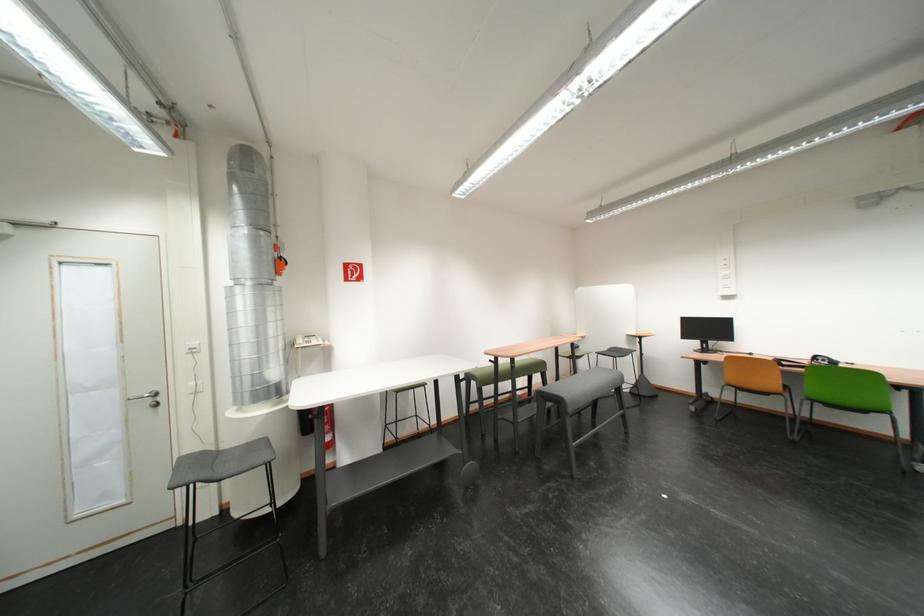
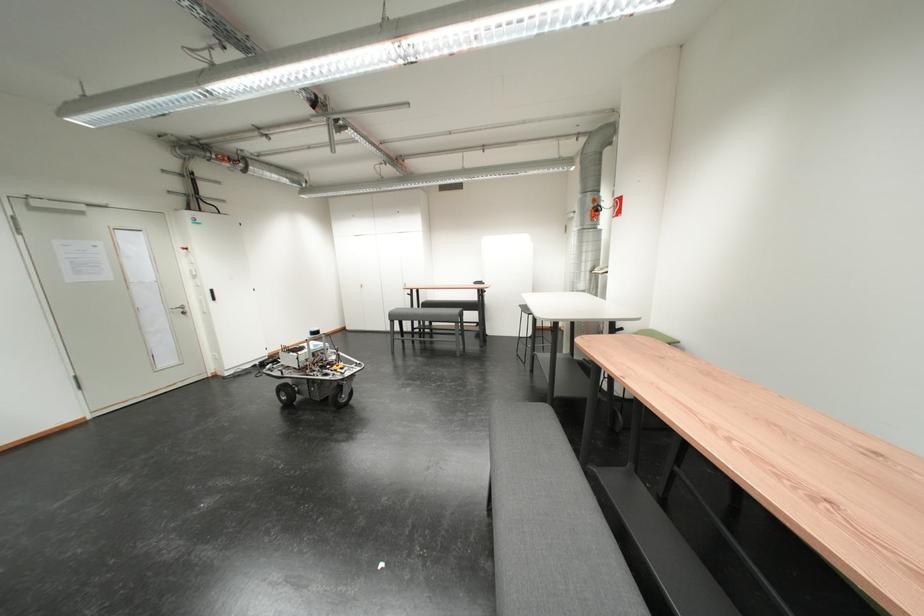
The point at (517, 541) is marked in the first image. Where is the corresponding point in the second image?

(494, 419)